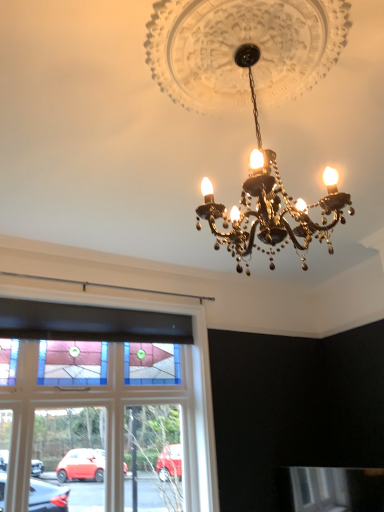
Question: Would you say gold metallic chandelier at center is a long distance from stained glass window at center?

Choices:
 (A) no
 (B) yes

Answer: (B)

Question: Is gold metallic chandelier at center next to stained glass window at center?

Choices:
 (A) yes
 (B) no

Answer: (B)

Question: Is gold metallic chandelier at center facing away from stained glass window at center?

Choices:
 (A) yes
 (B) no

Answer: (B)

Question: Is gold metallic chandelier at center to the right of stained glass window at center from the viewer's perspective?

Choices:
 (A) no
 (B) yes

Answer: (B)

Question: Does gold metallic chandelier at center appear on the left side of stained glass window at center?

Choices:
 (A) no
 (B) yes

Answer: (A)

Question: Is gold metallic chandelier at center thinner than stained glass window at center?

Choices:
 (A) yes
 (B) no

Answer: (B)

Question: Would you say stained glass window at center contains gold metallic chandelier at center?

Choices:
 (A) yes
 (B) no

Answer: (B)

Question: Are stained glass window at center and gold metallic chandelier at center making contact?

Choices:
 (A) no
 (B) yes

Answer: (A)

Question: From the image's perspective, is stained glass window at center located beneath gold metallic chandelier at center?

Choices:
 (A) yes
 (B) no

Answer: (A)

Question: Can you confirm if stained glass window at center is shorter than gold metallic chandelier at center?

Choices:
 (A) yes
 (B) no

Answer: (B)

Question: From a real-world perspective, is stained glass window at center located higher than gold metallic chandelier at center?

Choices:
 (A) no
 (B) yes

Answer: (A)

Question: Is stained glass window at center thinner than gold metallic chandelier at center?

Choices:
 (A) no
 (B) yes

Answer: (B)

Question: From their relative heights in the image, would you say stained glass window at center is taller or shorter than gold metallic chandelier at center?

Choices:
 (A) short
 (B) tall

Answer: (B)